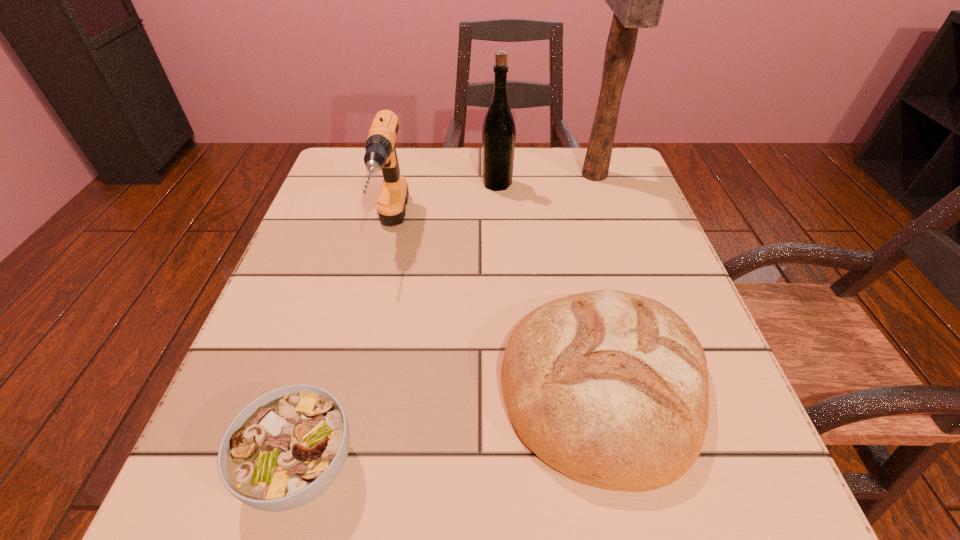
Find the location of a particular element. object identified as the closest to the shortest object is located at coordinates (610, 388).

The width and height of the screenshot is (960, 540). What are the coordinates of `free spot that satisfies the following two spatial constraints: 1. on the back side of the bread; 2. on the left side of the soup bowl` in the screenshot? It's located at (325, 385).

Where is `vacant region that satisfies the following two spatial constraints: 1. at the tip of the third tallest object; 2. on the right side of the bread`? vacant region that satisfies the following two spatial constraints: 1. at the tip of the third tallest object; 2. on the right side of the bread is located at coordinates (356, 385).